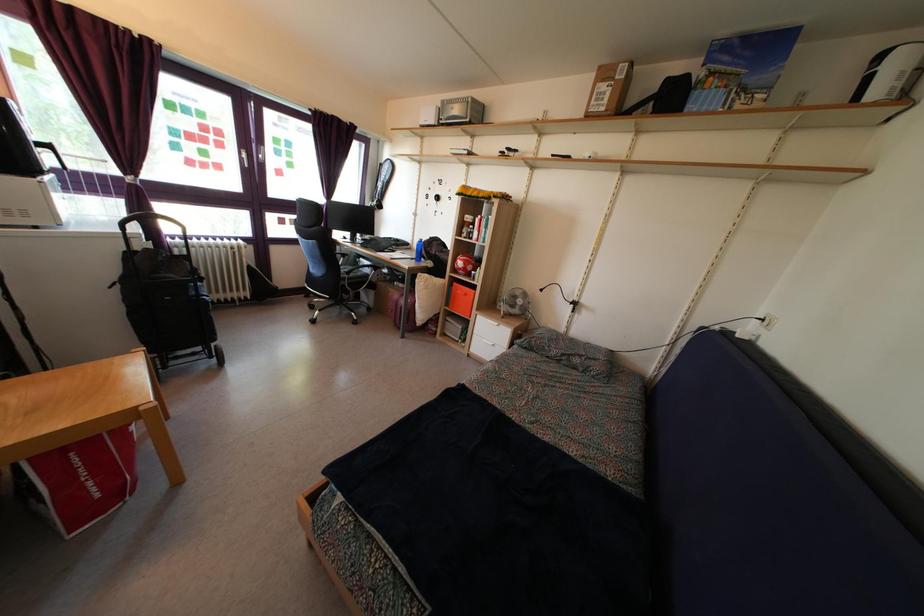
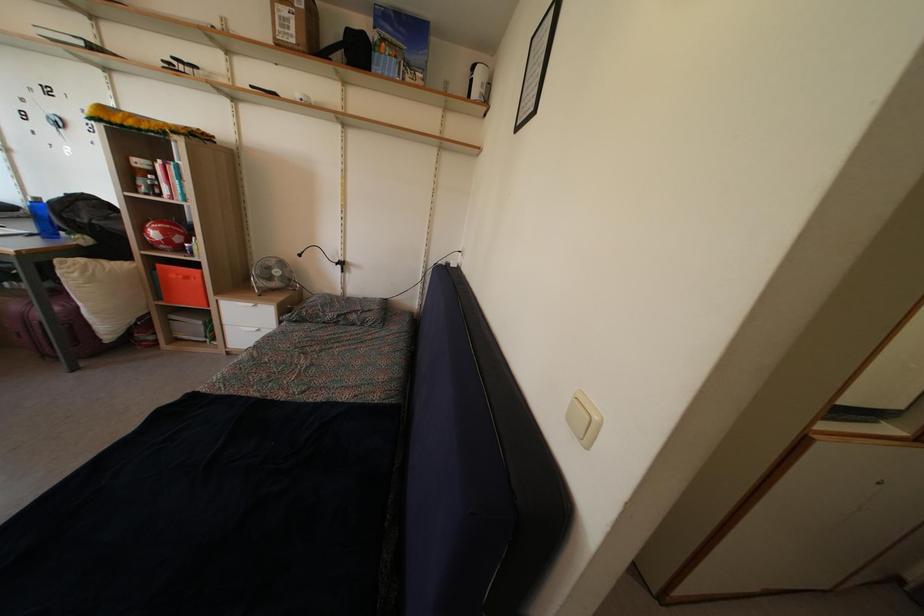
The point at (x=467, y=196) is marked in the first image. Where is the corresponding point in the second image?

(106, 116)